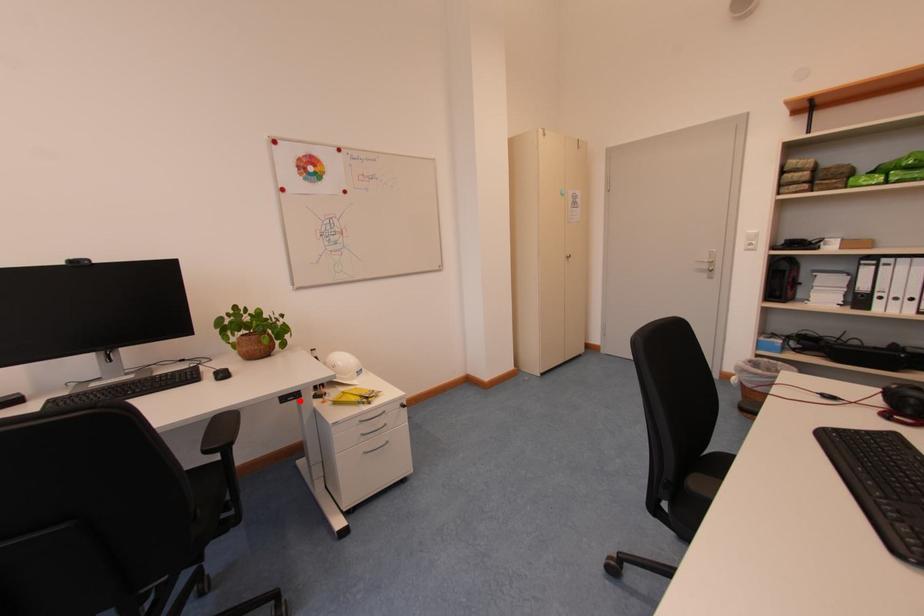
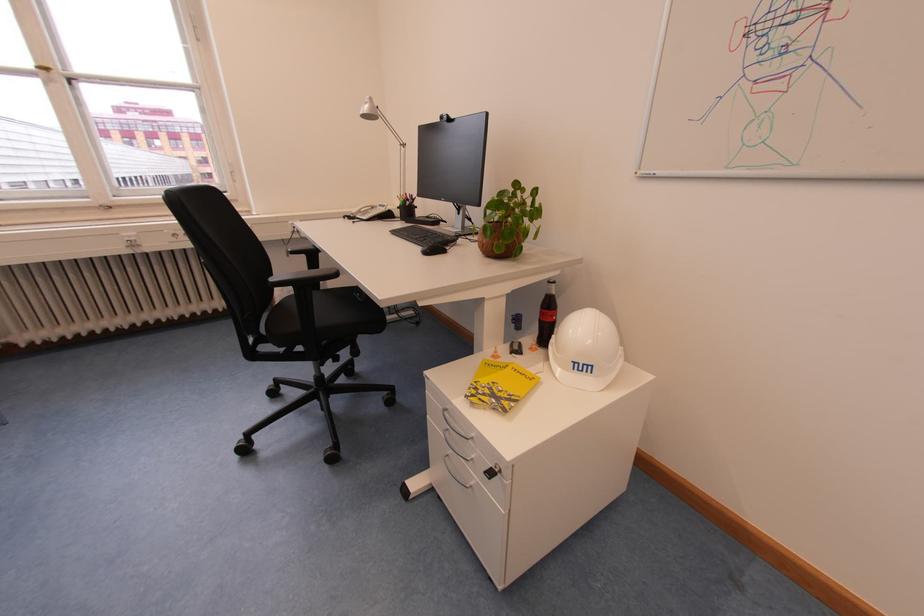
Question: A red point is marked in image1. In image2, is the corresponding 3D point closer to the camera or farther? Reply with the corresponding letter.

Choices:
 (A) The corresponding 3D point is closer.
 (B) The corresponding 3D point is farther.

Answer: (B)